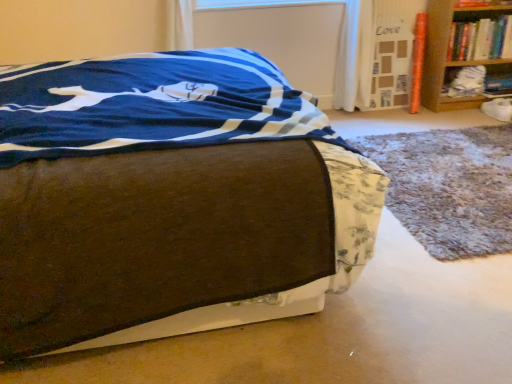
Question: Would you say hardcover book at upper right is part of brown fabric bed at center's contents?

Choices:
 (A) no
 (B) yes

Answer: (A)

Question: Does brown fabric bed at center have a greater height compared to hardcover book at upper right?

Choices:
 (A) no
 (B) yes

Answer: (B)

Question: From a real-world perspective, is brown fabric bed at center physically below hardcover book at upper right?

Choices:
 (A) no
 (B) yes

Answer: (B)

Question: From a real-world perspective, is brown fabric bed at center located higher than hardcover book at upper right?

Choices:
 (A) yes
 (B) no

Answer: (B)

Question: Does brown fabric bed at center appear on the left side of hardcover book at upper right?

Choices:
 (A) yes
 (B) no

Answer: (A)

Question: Considering the positions of brown fabric bed at center and white fabric at right, which is counted as the second shelf, starting from the right, in the image, is brown fabric bed at center wider or thinner than white fabric at right, which is counted as the second shelf, starting from the right,?

Choices:
 (A) wide
 (B) thin

Answer: (A)

Question: From the image's perspective, is brown fabric bed at center located above or below white fabric at right, which is counted as the second shelf, starting from the right?

Choices:
 (A) below
 (B) above

Answer: (A)

Question: From their relative heights in the image, would you say brown fabric bed at center is taller or shorter than white fabric at right, which is counted as the second shelf, starting from the right?

Choices:
 (A) tall
 (B) short

Answer: (A)

Question: Visually, is brown fabric bed at center positioned to the left or to the right of white fabric at right, which is counted as the second shelf, starting from the right?

Choices:
 (A) left
 (B) right

Answer: (A)

Question: From a real-world perspective, relative to brown fabric bed at center, is white fabric at right, which is counted as the second shelf, starting from the right, vertically above or below?

Choices:
 (A) above
 (B) below

Answer: (B)

Question: In terms of width, does white fabric at right, marked as the first shelf in a left-to-right arrangement, look wider or thinner when compared to brown fabric bed at center?

Choices:
 (A) wide
 (B) thin

Answer: (B)

Question: Is white fabric at right, marked as the first shelf in a left-to-right arrangement, inside the boundaries of brown fabric bed at center, or outside?

Choices:
 (A) inside
 (B) outside

Answer: (B)

Question: Visually, is white fabric at right, which is counted as the second shelf, starting from the right, positioned to the left or to the right of brown fabric bed at center?

Choices:
 (A) left
 (B) right

Answer: (B)

Question: Relative to brown fabric bed at center, is wooden bookshelf at upper right, the first shelf positioned from the right, in front or behind?

Choices:
 (A) behind
 (B) front

Answer: (A)

Question: Do you think wooden bookshelf at upper right, marked as the 2th shelf in a left-to-right arrangement, is within brown fabric bed at center, or outside of it?

Choices:
 (A) outside
 (B) inside

Answer: (A)